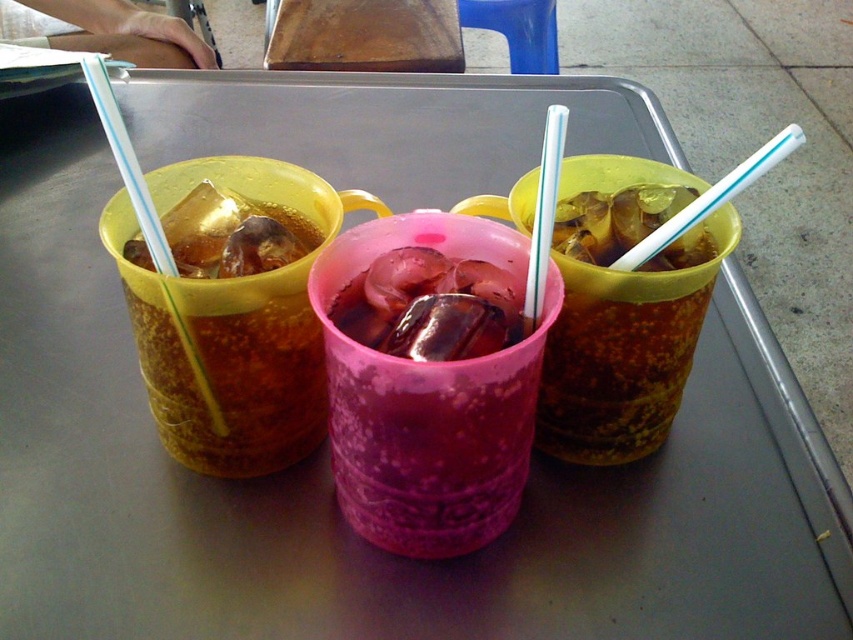
Question: Which object is positioned farthest from the translucent yellow cup at left?

Choices:
 (A) translucent plastic straw at right
 (B) transparent plastic straw at left
 (C) transparent plastic straw at center
 (D) translucent yellow cup at center

Answer: (A)

Question: In this image, where is translucent pink cup at center located relative to translucent yellow cup at center?

Choices:
 (A) above
 (B) below

Answer: (B)

Question: Does translucent yellow cup at center lie in front of transparent plastic straw at left?

Choices:
 (A) no
 (B) yes

Answer: (A)

Question: Which point is farther from the camera taking this photo?

Choices:
 (A) (270, 458)
 (B) (735, 186)
 (C) (631, 337)

Answer: (A)

Question: Is translucent yellow cup at left to the left of translucent plastic straw at right from the viewer's perspective?

Choices:
 (A) yes
 (B) no

Answer: (A)

Question: Which point is closer to the camera taking this photo?

Choices:
 (A) (254, 388)
 (B) (605, 412)
 (C) (527, 328)
 (D) (167, 259)

Answer: (C)